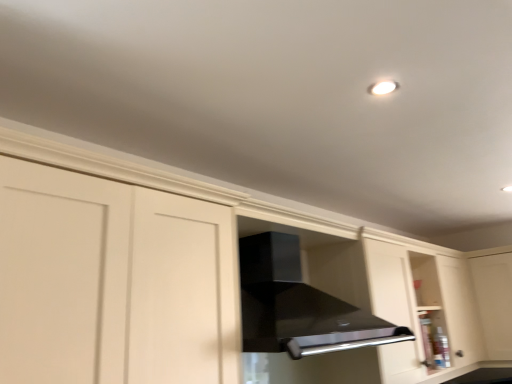
Question: Based on their positions, is black glossy vent at center located to the left or right of transparent glass cabinet at right?

Choices:
 (A) left
 (B) right

Answer: (A)

Question: Is point click(x=268, y=332) closer or farther from the camera than point click(x=506, y=344)?

Choices:
 (A) farther
 (B) closer

Answer: (B)

Question: From a real-world perspective, is black glossy vent at center physically located above or below transparent glass cabinet at right?

Choices:
 (A) below
 (B) above

Answer: (B)

Question: Is point (485, 322) positioned closer to the camera than point (290, 279)?

Choices:
 (A) farther
 (B) closer

Answer: (A)

Question: Looking at their shapes, would you say transparent glass cabinet at right is wider or thinner than black glossy vent at center?

Choices:
 (A) wide
 (B) thin

Answer: (B)

Question: From the image's perspective, relative to black glossy vent at center, is transparent glass cabinet at right above or below?

Choices:
 (A) above
 (B) below

Answer: (B)

Question: Considering the positions of transparent glass cabinet at right and black glossy vent at center in the image, is transparent glass cabinet at right bigger or smaller than black glossy vent at center?

Choices:
 (A) big
 (B) small

Answer: (B)